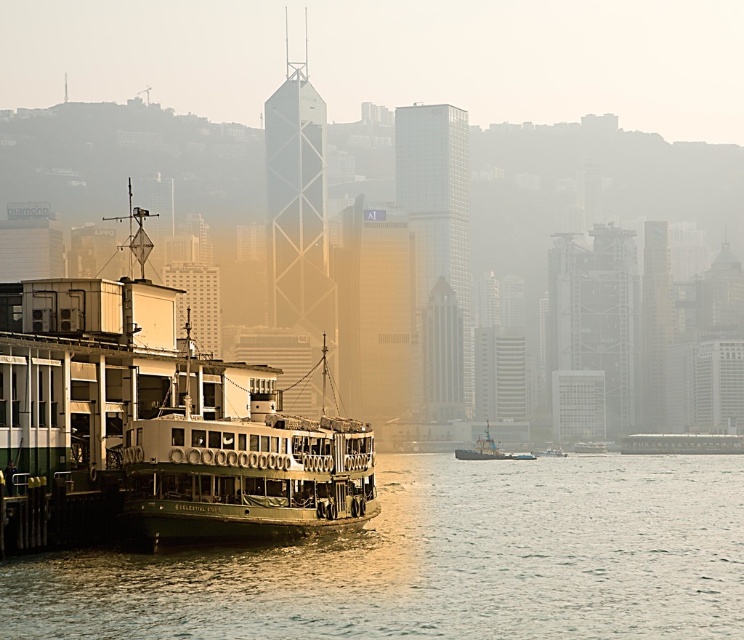
You are standing at the pier where the ferry is docked. There are two points marked in the image. Which point, point (628, 552) or point (478, 448), is closer to you?

Point (628, 552) is closer to the viewer than point (478, 448).

You are a photographer planning to capture the green matte ferry at center from the smooth water at lower left. Considering the possible width difference between the two, would you position yourself closer to the water or the ferry to ensure the ferry fills the frame adequately?

The smooth water at lower left might be wider than the green matte ferry at center, so positioning yourself closer to the ferry would help ensure it fills the frame adequately without being dwarfed by the wider water area.

You are a photographer positioned on the dock, aiming to capture the green matte ferry at center and the smooth water at lower left in your shot. Based on their positions, which object appears closer to the camera in the image?

The smooth water at lower left appears closer to the camera because it is taller than the green matte ferry at center, indicating it occupies more of the foreground in the image.